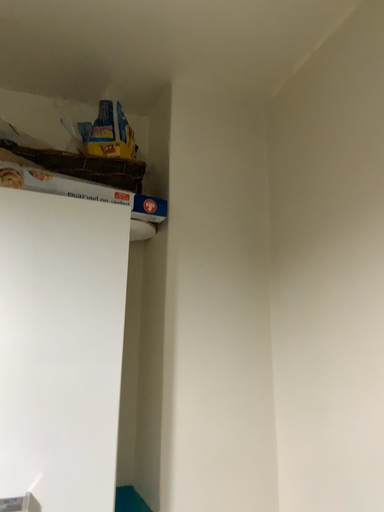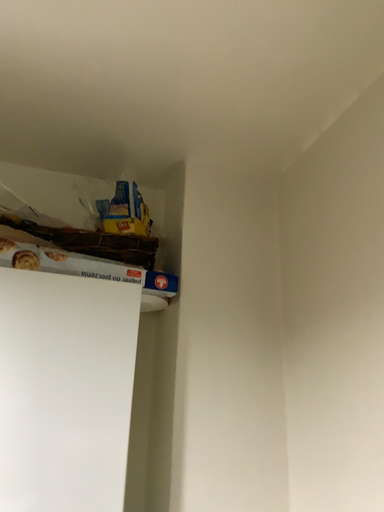
Question: Which way did the camera rotate in the video?

Choices:
 (A) rotated upward
 (B) rotated downward

Answer: (A)